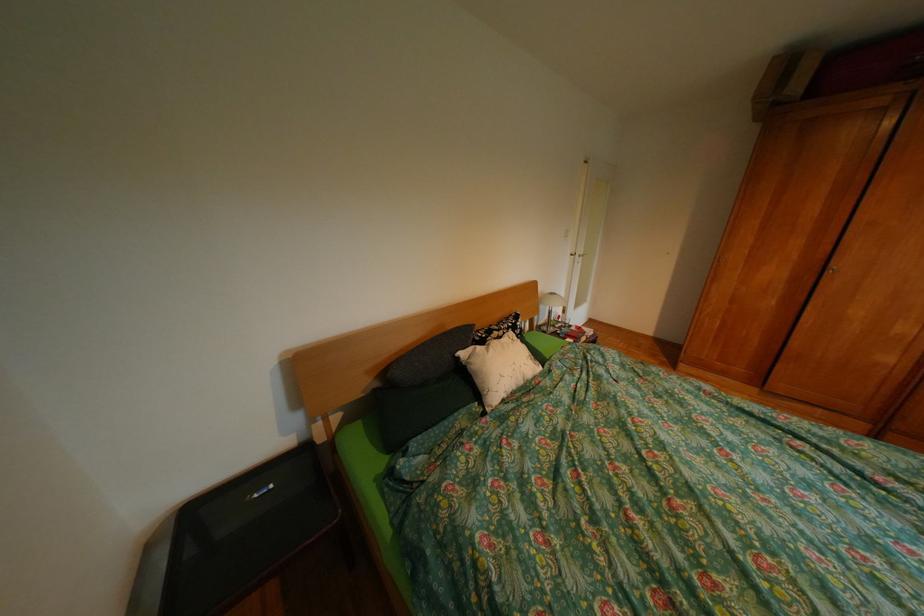
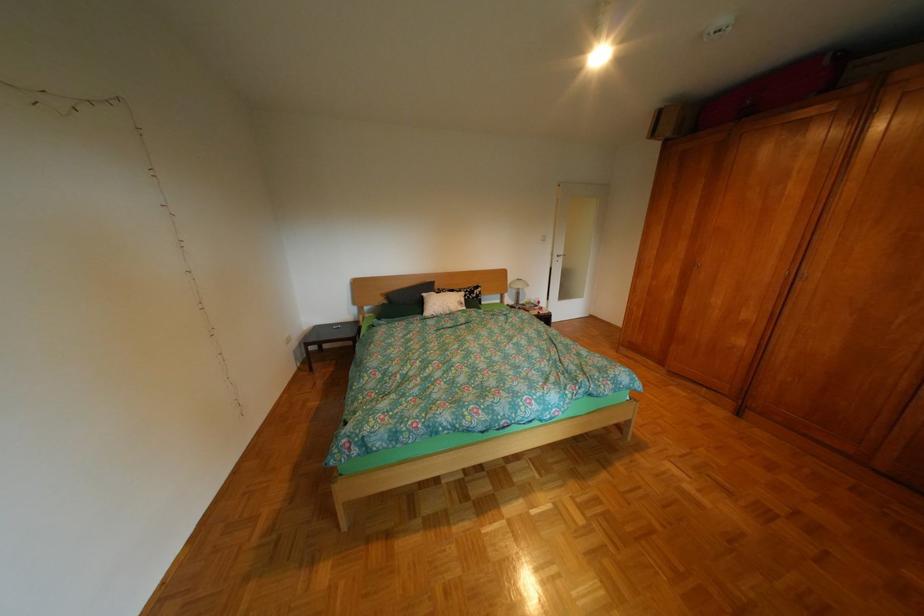
In the second image, find the point that corresponds to point (392, 385) in the first image.

(400, 302)